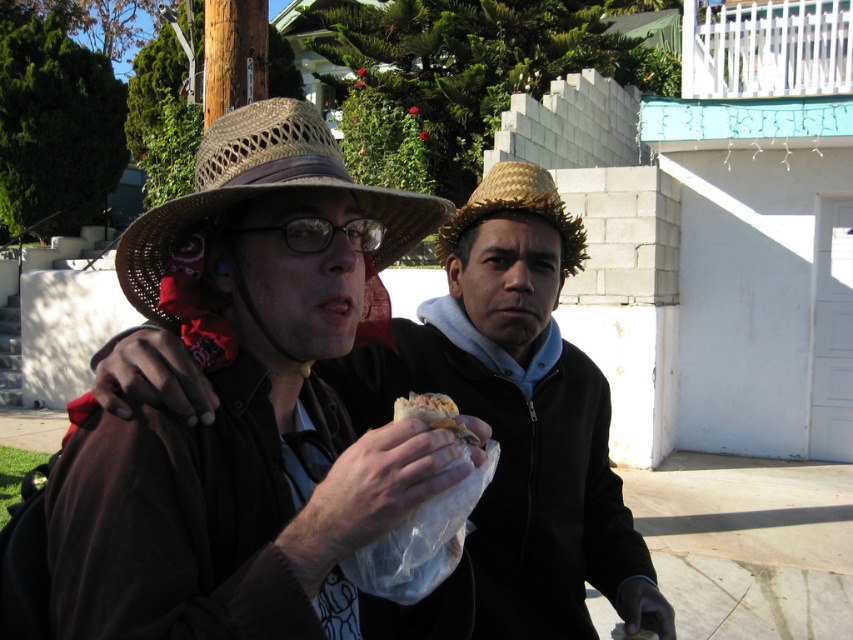
Is point (434, 332) positioned behind point (415, 228)?

Yes.

How much distance is there between matte brown hat at center and woven straw hat at center?

matte brown hat at center is 51.28 centimeters away from woven straw hat at center.

At what (x,y) coordinates should I click in order to perform the action: click on matte brown hat at center. Please return your answer as a coordinate pair (x, y). Looking at the image, I should click on (518, 413).

I want to click on matte brown hat at center, so click(x=518, y=413).

Does matte brown hat at center have a lesser height compared to strawmaterial/texturehat at center?

No.

Does point (538, 177) come in front of point (531, 170)?

Yes, point (538, 177) is in front of point (531, 170).

Identify the location of matte brown hat at center. (518, 413).

Describe the element at coordinates (263, 192) in the screenshot. The image size is (853, 640). I see `woven straw hat at center` at that location.

Does woven straw hat at center have a lesser height compared to strawmaterial/texturehat at center?

Incorrect, woven straw hat at center's height does not fall short of strawmaterial/texturehat at center's.

Between point (260, 124) and point (561, 208), which one is positioned in front?

Positioned in front is point (260, 124).

You are a GUI agent. You are given a task and a screenshot of the screen. Output one action in this format:
    pyautogui.click(x=<x>, y=<y>)
    Task: Click on the woven straw hat at center
    This screenshot has height=640, width=853.
    Given the screenshot: What is the action you would take?
    pyautogui.click(x=263, y=192)